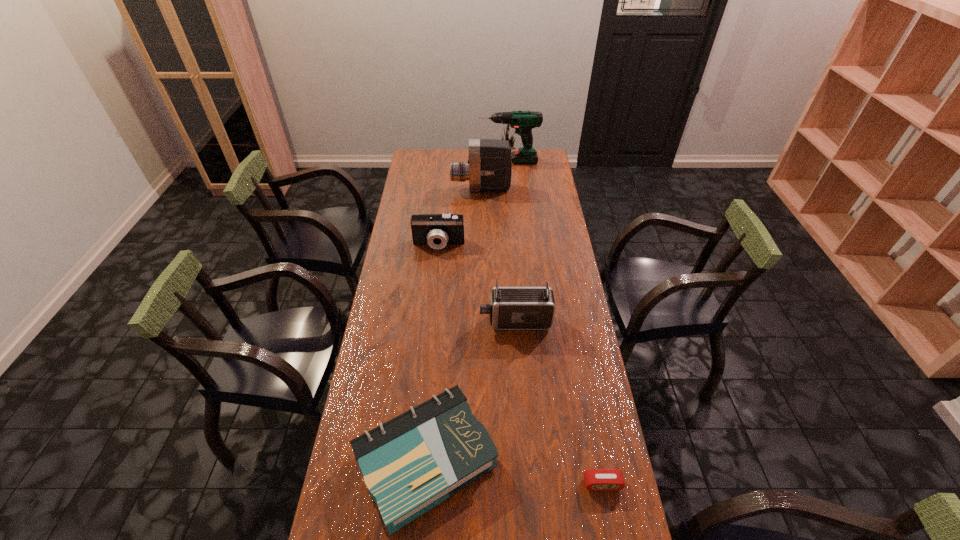
This screenshot has height=540, width=960. I want to click on vacant region at the right edge, so click(x=533, y=257).

Where is `vacant position at the far left corner of the desktop`? vacant position at the far left corner of the desktop is located at coordinates (425, 168).

Locate an element on the screen. The height and width of the screenshot is (540, 960). vacant area that lies between the shortest object and the farthest object is located at coordinates (555, 322).

The image size is (960, 540). Identify the location of free space between the second shortest object and the fifth nearest object. (453, 325).

Find the location of a particular element. This screenshot has height=540, width=960. vacant area that lies between the alarm clock and the drill is located at coordinates [555, 322].

Image resolution: width=960 pixels, height=540 pixels. Find the location of `free space between the second tallest camcorder and the farthest object`. free space between the second tallest camcorder and the farthest object is located at coordinates (512, 241).

This screenshot has width=960, height=540. What are the coordinates of `free space that is in between the alarm clock and the shortest camcorder` in the screenshot? It's located at (520, 364).

Image resolution: width=960 pixels, height=540 pixels. What are the coordinates of `free spot between the third tallest object and the fifth nearest object` in the screenshot? It's located at (498, 255).

Where is `free space between the drill and the fifth tallest object`? The image size is (960, 540). free space between the drill and the fifth tallest object is located at coordinates (467, 311).

Locate an element on the screen. The width and height of the screenshot is (960, 540). free space between the drill and the nearest camcorder is located at coordinates (512, 241).